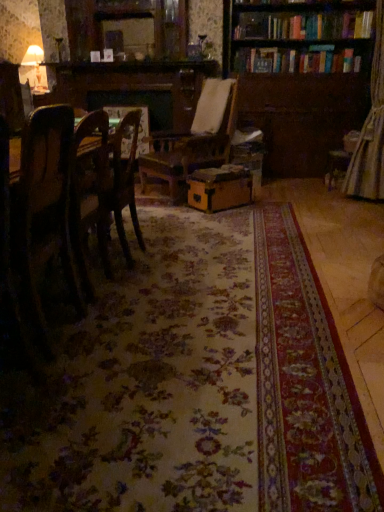
Question: Is wooden chair at left thinner than matte brown cardboard box at center?

Choices:
 (A) yes
 (B) no

Answer: (A)

Question: Is matte brown cardboard box at center located within wooden chair at left?

Choices:
 (A) no
 (B) yes

Answer: (A)

Question: Is wooden chair at left wider than matte brown cardboard box at center?

Choices:
 (A) yes
 (B) no

Answer: (B)

Question: Does wooden chair at left have a larger size compared to matte brown cardboard box at center?

Choices:
 (A) no
 (B) yes

Answer: (B)

Question: Can we say wooden chair at left lies outside matte brown cardboard box at center?

Choices:
 (A) no
 (B) yes

Answer: (B)

Question: Is wooden chair at left not close to matte brown cardboard box at center?

Choices:
 (A) no
 (B) yes

Answer: (B)

Question: From the image's perspective, is matte brown cardboard box at center located beneath wooden bookcase at upper right?

Choices:
 (A) no
 (B) yes

Answer: (B)

Question: Does matte brown cardboard box at center turn towards wooden bookcase at upper right?

Choices:
 (A) no
 (B) yes

Answer: (A)

Question: Is matte brown cardboard box at center turned away from wooden bookcase at upper right?

Choices:
 (A) yes
 (B) no

Answer: (A)

Question: Considering the relative sizes of matte brown cardboard box at center and wooden bookcase at upper right in the image provided, is matte brown cardboard box at center taller than wooden bookcase at upper right?

Choices:
 (A) no
 (B) yes

Answer: (A)

Question: Does matte brown cardboard box at center appear on the left side of wooden bookcase at upper right?

Choices:
 (A) no
 (B) yes

Answer: (B)

Question: Are matte brown cardboard box at center and wooden bookcase at upper right located far from each other?

Choices:
 (A) no
 (B) yes

Answer: (B)

Question: Does matte brown cardboard box at center have a lesser width compared to wooden chair at left?

Choices:
 (A) no
 (B) yes

Answer: (A)